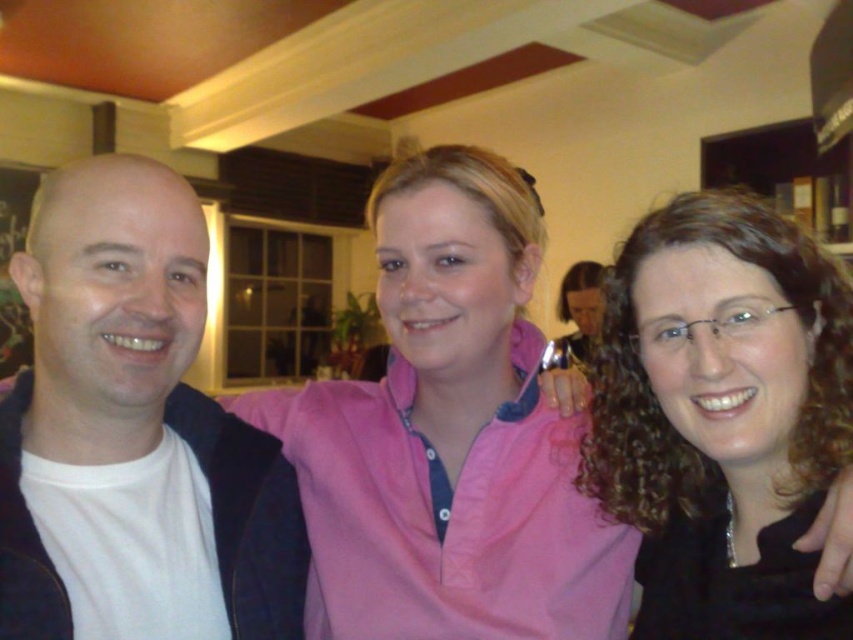
Question: Considering the real-world distances, which object is farthest from the curly brown hair at center?

Choices:
 (A) pink cotton shirt at center
 (B) white matte t-shirt at left

Answer: (B)

Question: Is pink cotton shirt at center to the left of white matte t-shirt at left from the viewer's perspective?

Choices:
 (A) yes
 (B) no

Answer: (B)

Question: Does pink cotton shirt at center have a larger size compared to white matte t-shirt at left?

Choices:
 (A) yes
 (B) no

Answer: (A)

Question: Which point is closer to the camera?

Choices:
 (A) (599, 614)
 (B) (57, 340)

Answer: (B)

Question: Where is white matte t-shirt at left located in relation to curly brown hair at center in the image?

Choices:
 (A) left
 (B) right

Answer: (A)

Question: Which object is the farthest from the white matte t-shirt at left?

Choices:
 (A) curly brown hair at center
 (B) pink cotton shirt at center

Answer: (A)